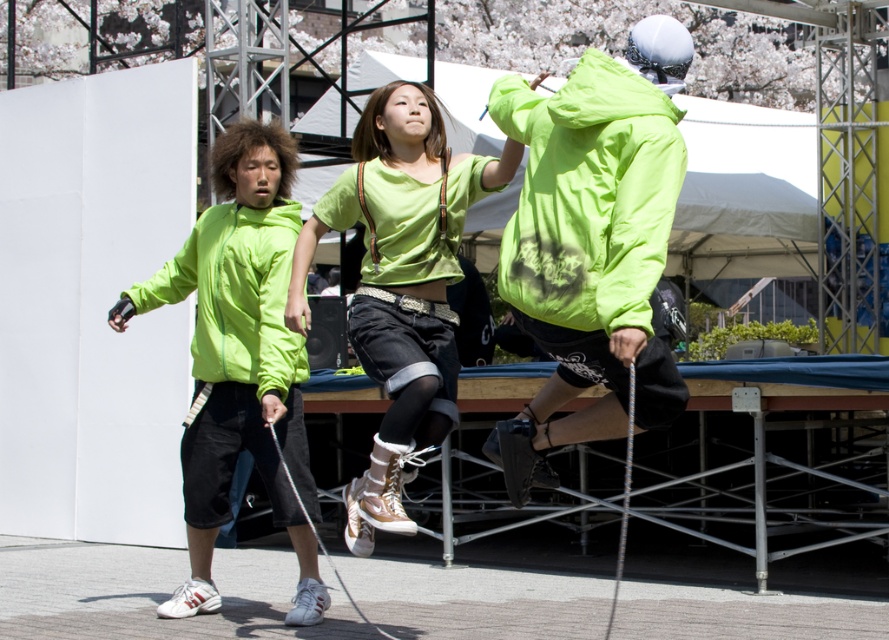
Question: Does neon green jacket at center have a lesser width compared to matte green shirt at center?

Choices:
 (A) no
 (B) yes

Answer: (B)

Question: Does matte green shirt at center appear on the left side of neon green fabric sweatshirt at center?

Choices:
 (A) yes
 (B) no

Answer: (B)

Question: Is neon green jacket at center positioned at the back of neon green fabric sweatshirt at center?

Choices:
 (A) yes
 (B) no

Answer: (B)

Question: Which of the following is the farthest from the observer?

Choices:
 (A) neon green fabric sweatshirt at center
 (B) matte green shirt at center
 (C) neon green jacket at left
 (D) neon green jacket at center

Answer: (A)

Question: Which point is closer to the camera taking this photo?

Choices:
 (A) (394, 212)
 (B) (235, 353)
 (C) (261, 346)

Answer: (A)

Question: Which of the following is the closest to the observer?

Choices:
 (A) (270, 358)
 (B) (202, 490)

Answer: (A)